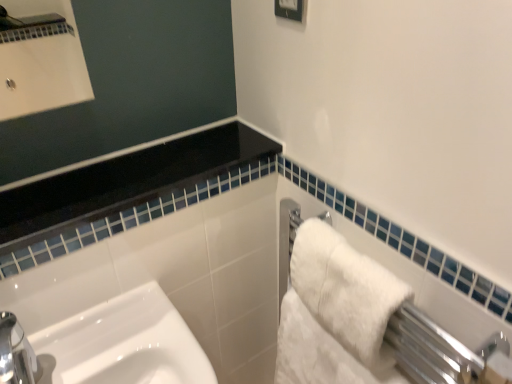
Question: Is white glossy frame at upper center located outside white fluffy bath towel at right, the second bath towel in the top-to-bottom sequence?

Choices:
 (A) no
 (B) yes

Answer: (B)

Question: Does white glossy frame at upper center have a greater width compared to white fluffy bath towel at right, arranged as the 1th bath towel when ordered from the bottom?

Choices:
 (A) yes
 (B) no

Answer: (B)

Question: From a real-world perspective, is white glossy frame at upper center located higher than white fluffy bath towel at right, the second bath towel in the top-to-bottom sequence?

Choices:
 (A) yes
 (B) no

Answer: (A)

Question: From the image's perspective, does white glossy frame at upper center appear higher than white fluffy bath towel at right, arranged as the 1th bath towel when ordered from the bottom?

Choices:
 (A) yes
 (B) no

Answer: (A)

Question: Considering the relative sizes of white glossy frame at upper center and white fluffy bath towel at right, the second bath towel in the top-to-bottom sequence, in the image provided, is white glossy frame at upper center taller than white fluffy bath towel at right, the second bath towel in the top-to-bottom sequence,?

Choices:
 (A) no
 (B) yes

Answer: (A)

Question: Is white glossy frame at upper center placed right next to white fluffy bath towel at right, the second bath towel in the top-to-bottom sequence?

Choices:
 (A) yes
 (B) no

Answer: (B)

Question: Could you tell me if white fluffy bath towel at right, which is counted as the 2th bath towel, starting from the bottom, is facing white glossy frame at upper center?

Choices:
 (A) no
 (B) yes

Answer: (A)

Question: From the image's perspective, is white fluffy bath towel at right, which is counted as the 2th bath towel, starting from the bottom, over white glossy frame at upper center?

Choices:
 (A) no
 (B) yes

Answer: (A)

Question: Considering the relative sizes of white fluffy bath towel at right, the first bath towel in the top-to-bottom sequence, and white glossy frame at upper center in the image provided, is white fluffy bath towel at right, the first bath towel in the top-to-bottom sequence, wider than white glossy frame at upper center?

Choices:
 (A) no
 (B) yes

Answer: (B)

Question: Does white fluffy bath towel at right, the first bath towel in the top-to-bottom sequence, have a greater height compared to white glossy frame at upper center?

Choices:
 (A) no
 (B) yes

Answer: (B)

Question: Is white glossy frame at upper center located within white fluffy bath towel at right, the first bath towel in the top-to-bottom sequence?

Choices:
 (A) no
 (B) yes

Answer: (A)

Question: Is the position of white fluffy bath towel at right, the first bath towel in the top-to-bottom sequence, less distant than that of white glossy frame at upper center?

Choices:
 (A) yes
 (B) no

Answer: (A)

Question: Is white glossy frame at upper center at the back of white fluffy bath towel at right, arranged as the 1th bath towel when ordered from the bottom?

Choices:
 (A) yes
 (B) no

Answer: (B)